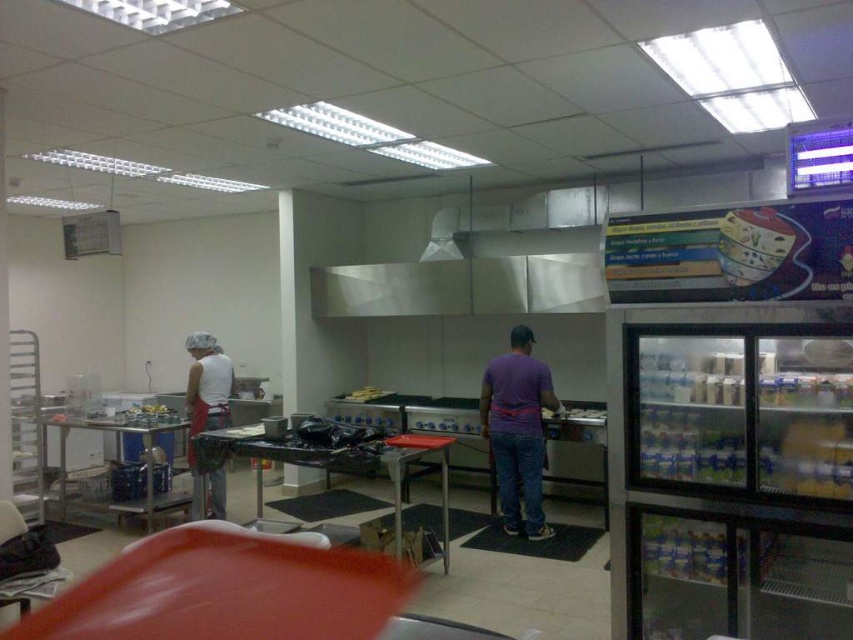
Between white matte apron at left and stainless steel exhaust hood at upper center, which one has less height?

stainless steel exhaust hood at upper center

Can you confirm if white matte apron at left is positioned to the left of stainless steel exhaust hood at upper center?

Yes, white matte apron at left is to the left of stainless steel exhaust hood at upper center.

Find the location of a particular element. The height and width of the screenshot is (640, 853). white matte apron at left is located at coordinates (206, 396).

Who is more forward, (514, 401) or (432, 237)?

Point (514, 401)

Locate an element on the screen. Image resolution: width=853 pixels, height=640 pixels. purple matte shirt at center is located at coordinates (517, 429).

Who is positioned more to the right, purple matte shirt at center or white matte apron at left?

purple matte shirt at center

Is point (540, 372) farther from camera compared to point (218, 483)?

No, it is not.

Where is `purple matte shirt at center`? This screenshot has height=640, width=853. purple matte shirt at center is located at coordinates (517, 429).